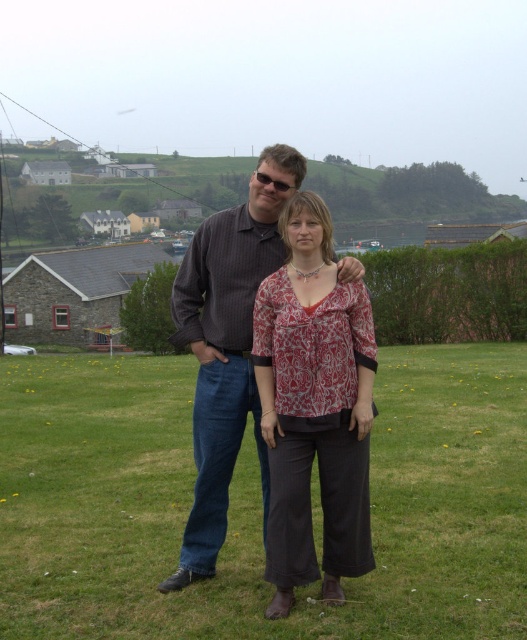
Consider the image. You are a photographer trying to capture a closeup of both the patterned fabric blouse at center and the dark brown striped shirt at center in the image. Given their sizes, which one should you zoom in on first to ensure both are in focus?

The patterned fabric blouse at center occupies less space than the dark brown striped shirt at center, so you should zoom in on the dark brown striped shirt at center first to ensure both are in focus.

You are standing on the green grass at center. Which direction should you move to get closer to the man on the left?

Since the green grass at center is located at point (x=258, y=502), moving towards the left direction would bring you closer to the man on the left.

You are a photographer setting up a camera to capture the two people in the scene. You want to ensure both the patterned fabric blouse at center and the dark brown striped shirt at center are clearly visible. Based on their widths, which clothing item should you focus on first to ensure proper framing?

The patterned fabric blouse at center has a lesser width compared to the dark brown striped shirt at center, so you should focus on the dark brown striped shirt at center first to ensure proper framing since it is wider and might require more attention to capture its details fully.